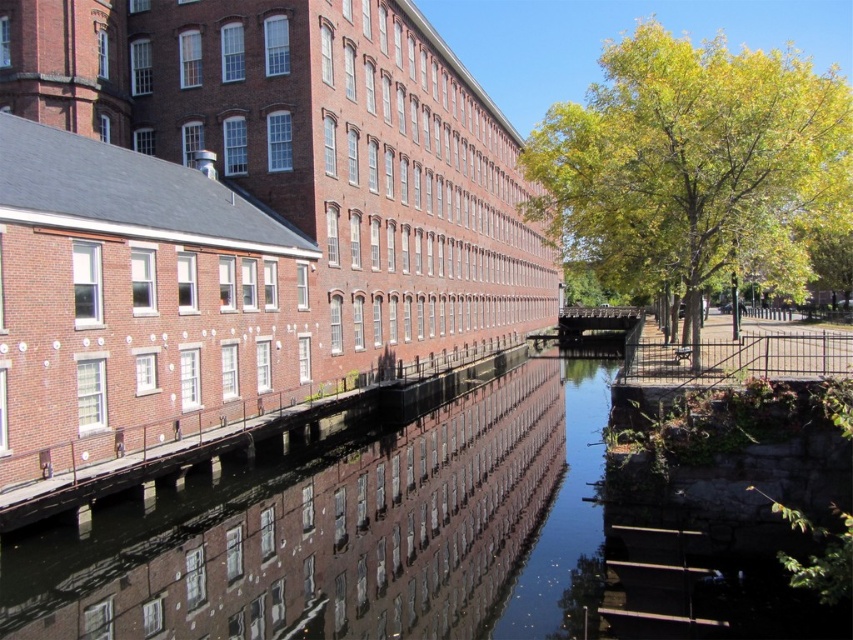
You are a tourist standing on the walkway next to the green leafy tree at right. You want to take a photo of the smooth concrete river at center and the tree in the same frame. Which object should you position closer to the camera to include both in your shot?

The smooth concrete river at center is in front of the green leafy tree at right, so you should position the smooth concrete river at center closer to the camera to include both in your shot.

You are standing at the origin point of the image coordinate system. You want to walk to the smooth concrete river at center. In which direction should you move relative to your current position?

The smooth concrete river at center is located at coordinate point 0.838 on the x axis and 0.421 on the y axis. Since you are at the origin point, you should move towards the positive x and positive y direction to reach it.

You are standing at the point marked as point (x=358, y=536) in the image. What is the closest object to you in the scene?

The smooth concrete river at center is located at point (x=358, y=536), so you are standing directly on it. Therefore, the closest object to you is the smooth concrete river at center.